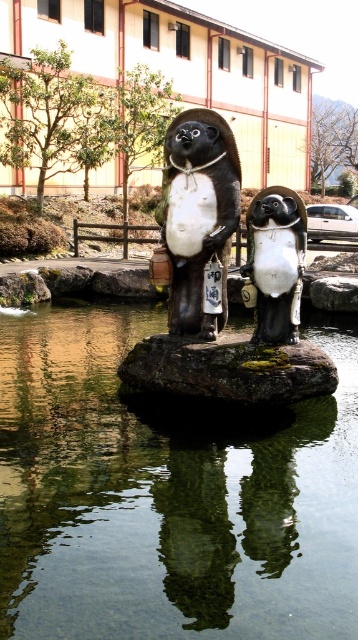
You are a delivery robot with a 12 feet long package. You need to move from the clear water at center to the shiny bronze penguin at center. Can you fit the package between them without bending it?

The distance between the clear water at center and the shiny bronze penguin at center is 10.92 feet, which is shorter than the 12 feet long package. Therefore, the package cannot fit between them without bending.

You are standing at the edge of the water in the scene and notice the shiny bronze penguin at center. Can you determine its exact coordinates?

The shiny bronze penguin at center is located at point (x=224, y=280).